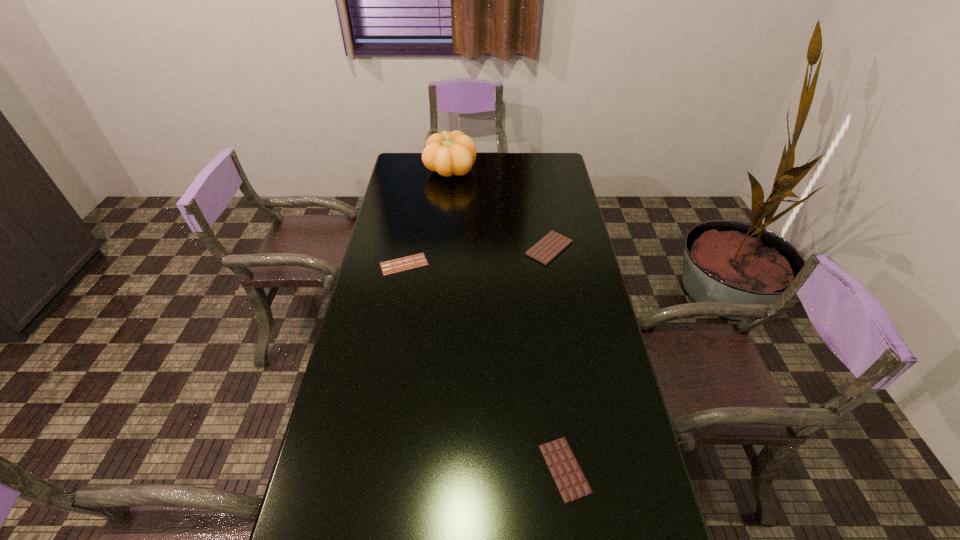
Image resolution: width=960 pixels, height=540 pixels. I want to click on pumpkin, so click(449, 153).

Find the location of a particular element. The height and width of the screenshot is (540, 960). the farthest object is located at coordinates (449, 153).

Find the location of a particular element. This screenshot has height=540, width=960. the third shortest object is located at coordinates (x=549, y=247).

You are a GUI agent. You are given a task and a screenshot of the screen. Output one action in this format:
    pyautogui.click(x=<x>, y=<y>)
    Task: Click on the leftmost chocolate bar
    The height and width of the screenshot is (540, 960).
    Given the screenshot: What is the action you would take?
    pyautogui.click(x=418, y=260)

The height and width of the screenshot is (540, 960). Find the location of `the nearest chocolate bar`. the nearest chocolate bar is located at coordinates 572,484.

Identify the location of vacant position located on the front of the tallest object. (446, 215).

You are a GUI agent. You are given a task and a screenshot of the screen. Output one action in this format:
    pyautogui.click(x=<x>, y=<y>)
    Task: Click on the vacant space located on the left of the tallest chocolate bar
    This screenshot has width=960, height=540.
    Given the screenshot: What is the action you would take?
    pyautogui.click(x=506, y=248)

This screenshot has width=960, height=540. I want to click on free region located 0.320m on the front of the leftmost chocolate bar, so click(x=389, y=350).

Find the location of a particular element. This screenshot has height=540, width=960. free space located 0.050m on the front of the nearest object is located at coordinates (573, 529).

Image resolution: width=960 pixels, height=540 pixels. Identify the location of object that is at the far edge. (449, 153).